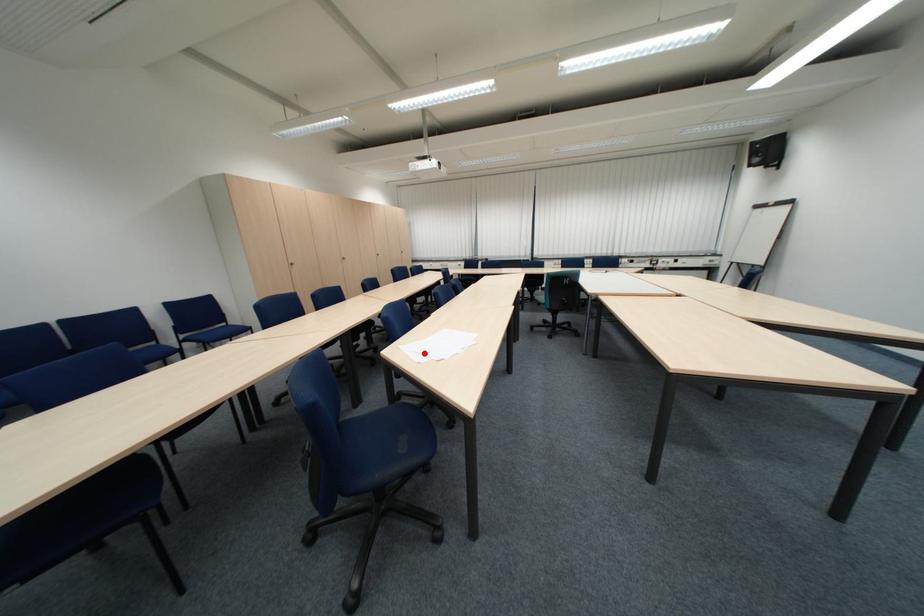
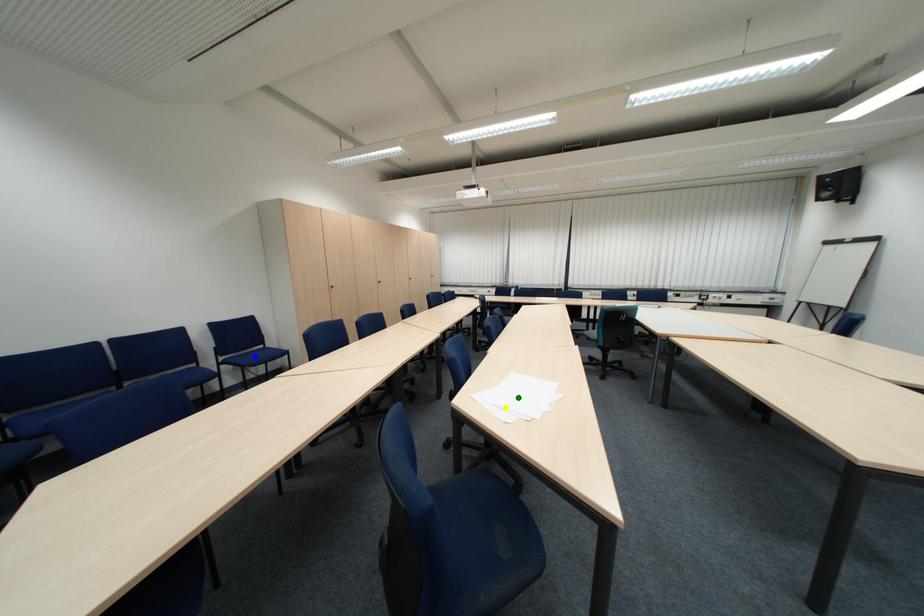
Question: I am providing you with two images of the same scene from different viewpoints. A red point is marked on the first image. You are given multiple points on the second image. Which point in image 2 is actually the same real-world point as the red point in image 1?

Choices:
 (A) green point
 (B) blue point
 (C) yellow point

Answer: (C)